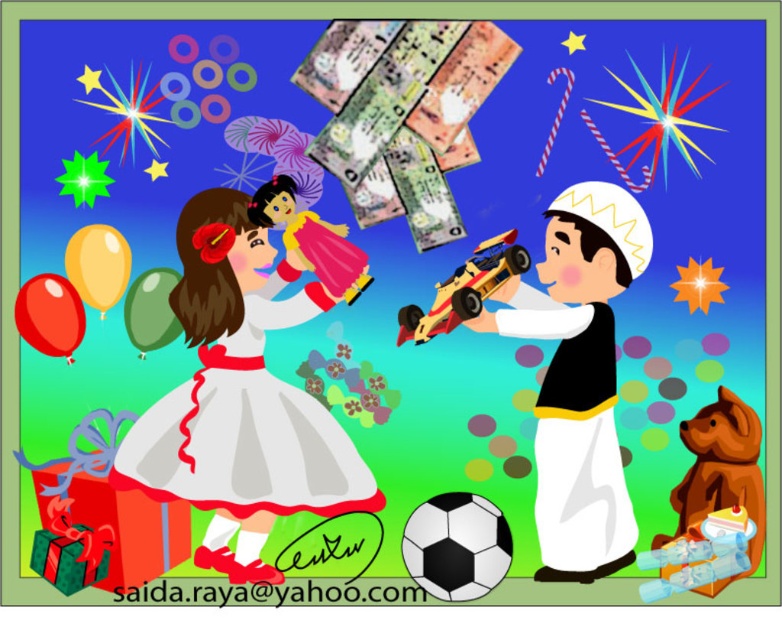
You are a photographer standing at the camera position. You want to take a closeup photo of the brown plush bear at lower right. Can you reach it without moving your position? The camera has a maximum zoom of 2 meters.

The brown plush bear at lower right is 2.89 meters from camera, which is beyond the camera maximum zoom of 2 meters. You cannot reach it without moving your position.

You are a child trying to decide which object to pick up first between the smooth plastic toy car at center and the yellow matte balloon at lower left. Which one is bigger?

The smooth plastic toy car at center is larger than the yellow matte balloon at lower left, so you should pick up the smooth plastic toy car at center first.

You are a photographer taking a picture of the scene. You want to focus on the matte white dress at center and the yellow matte balloon at lower left. Which object should you adjust your camera focus on first if you want to ensure both are in focus?

The matte white dress at center is closer to the viewer than the yellow matte balloon at lower left, so you should focus on the matte white dress at center first to ensure both are in focus.